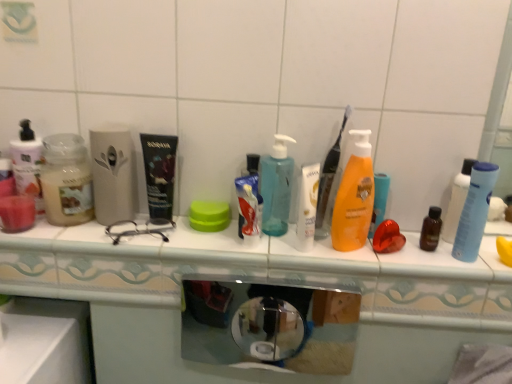
You are a GUI agent. You are given a task and a screenshot of the screen. Output one action in this format:
    pyautogui.click(x=<x>, y=<y>)
    Task: Click on the empty space that is to the right of matte glass jar at left, the first bottle positioned from the left
    
    Given the screenshot: What is the action you would take?
    click(145, 238)